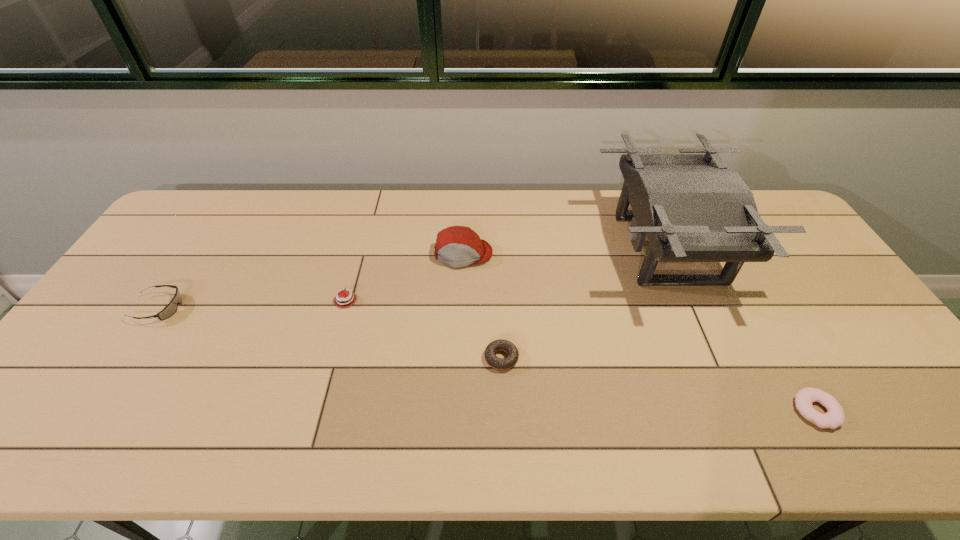
The height and width of the screenshot is (540, 960). I want to click on free space that satisfies the following two spatial constraints: 1. on the lenses of the goggles; 2. on the back side of the shorter doughnut, so click(x=91, y=410).

I want to click on free space that satisfies the following two spatial constraints: 1. on the front-facing side of the second tallest object; 2. on the right side of the left doughnut, so click(x=459, y=358).

You are a GUI agent. You are given a task and a screenshot of the screen. Output one action in this format:
    pyautogui.click(x=<x>, y=<y>)
    Task: Click on the vacant region that satisfies the following two spatial constraints: 1. on the front side of the chocolate cake; 2. on the lenses of the third tallest object
    The width and height of the screenshot is (960, 540).
    Given the screenshot: What is the action you would take?
    pyautogui.click(x=344, y=308)